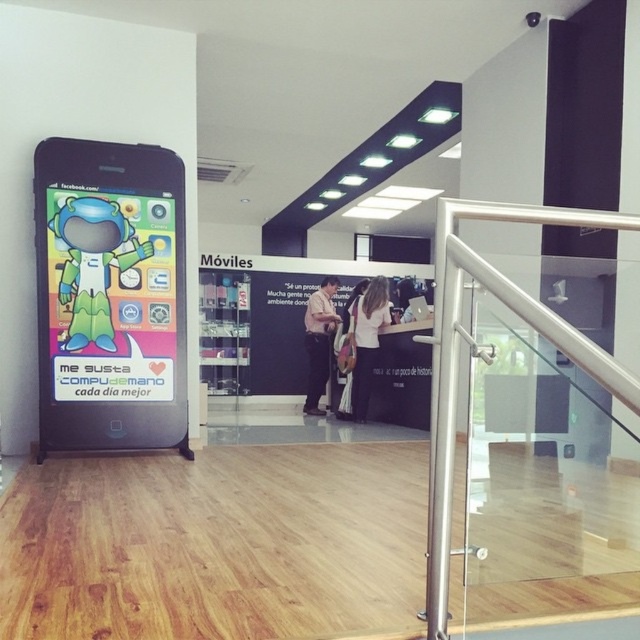
You are a customer in the electronics store and want to pick up the matte black smartphone at left. However, there is an obstacle blocking your path. Can you reach the smartphone without moving the white matte shirt at center?

The matte black smartphone at left is in front of the white matte shirt at center, so you can reach the smartphone without needing to move the shirt.

You are a customer in the electronics store and you want to buy a smartphone. You see a smartphone with a black frame and home button at the bottom. Is the point at coordinate [109,296] on the smartphone?

Yes, the point at coordinate [109,296] is on the matte black smartphone at left, so it is on the smartphone.

You are standing in the electronics store and want to pick up the matte black smartphone at left. Where should you look to find it?

The matte black smartphone at left is located at point (109, 296).